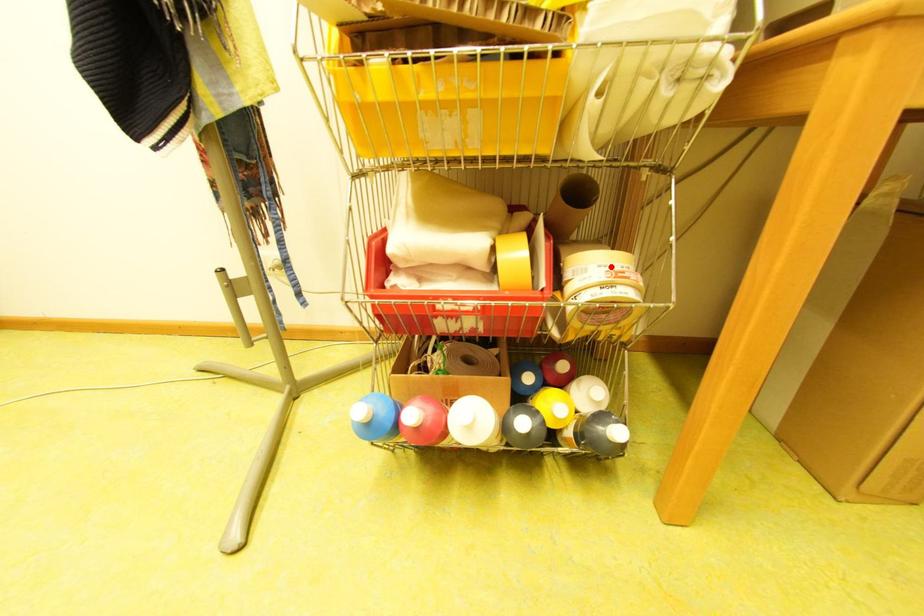
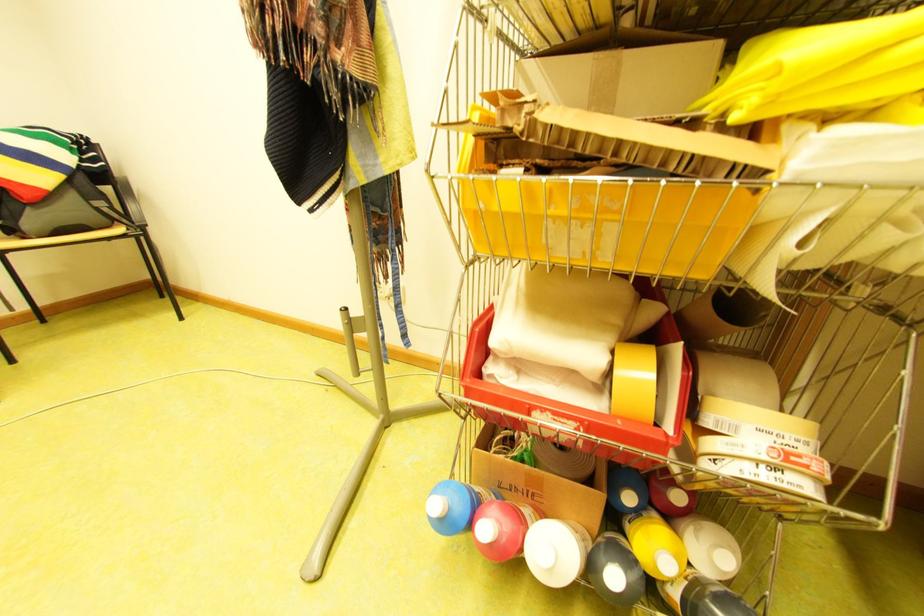
The point at the highlighted location is marked in the first image. Where is the corresponding point in the second image?

(772, 432)